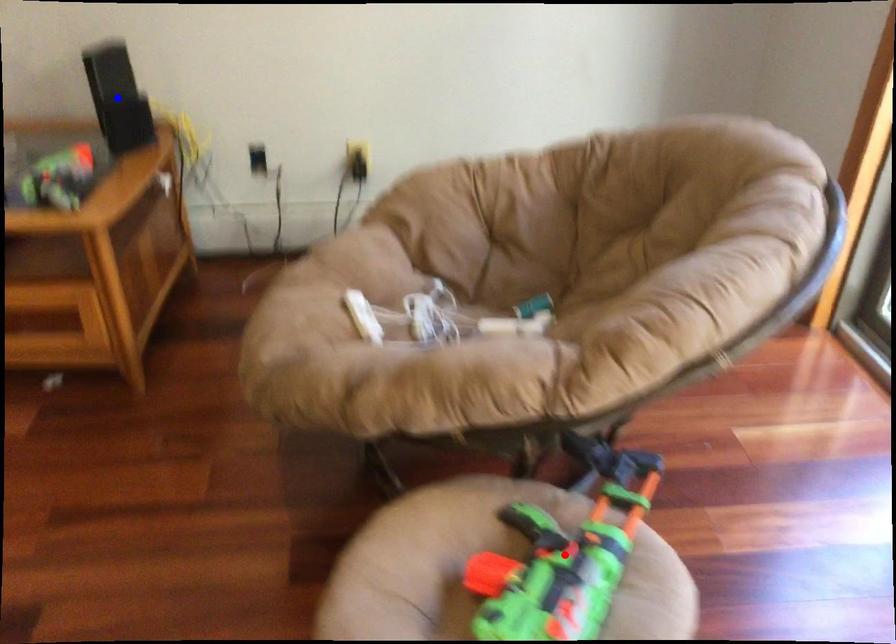
Question: In the image, two points are highlighted. Which point is nearer to the camera? Reply with the corresponding letter.

Choices:
 (A) blue point
 (B) red point

Answer: (B)